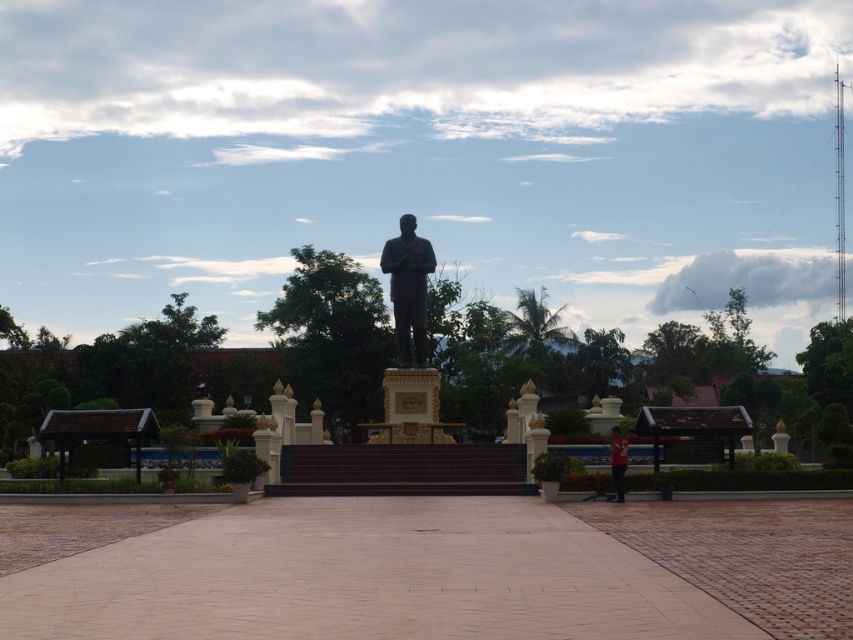
Question: Does black polished statue at center lie behind red fabric shirt at lower right?

Choices:
 (A) yes
 (B) no

Answer: (A)

Question: Among these objects, which one is farthest from the camera?

Choices:
 (A) black polished statue at center
 (B) bronze statue at center

Answer: (B)

Question: Which point appears closest to the camera in this image?

Choices:
 (A) coord(416,316)
 (B) coord(418,260)

Answer: (B)

Question: Does black polished statue at center have a lesser width compared to red fabric shirt at lower right?

Choices:
 (A) no
 (B) yes

Answer: (A)

Question: Which of the following is the farthest from the observer?

Choices:
 (A) red fabric shirt at lower right
 (B) bronze statue at center

Answer: (B)

Question: Does black polished statue at center lie behind red fabric shirt at lower right?

Choices:
 (A) yes
 (B) no

Answer: (A)